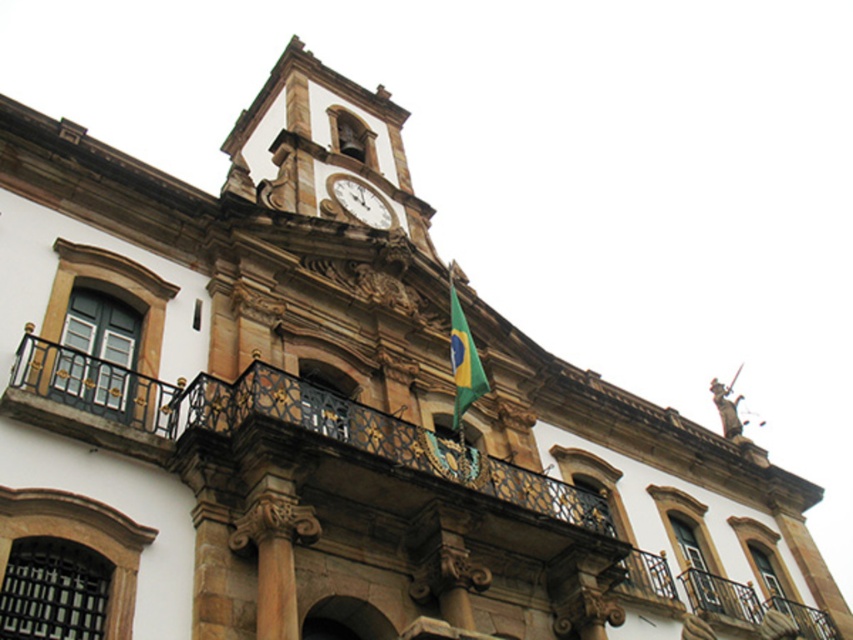
Who is positioned more to the left, green fabric flag at center or white marble clock at upper center?

From the viewer's perspective, white marble clock at upper center appears more on the left side.

Which is in front, point (468, 362) or point (358, 200)?

Point (468, 362) is in front.

Identify the location of green fabric flag at center. (463, 358).